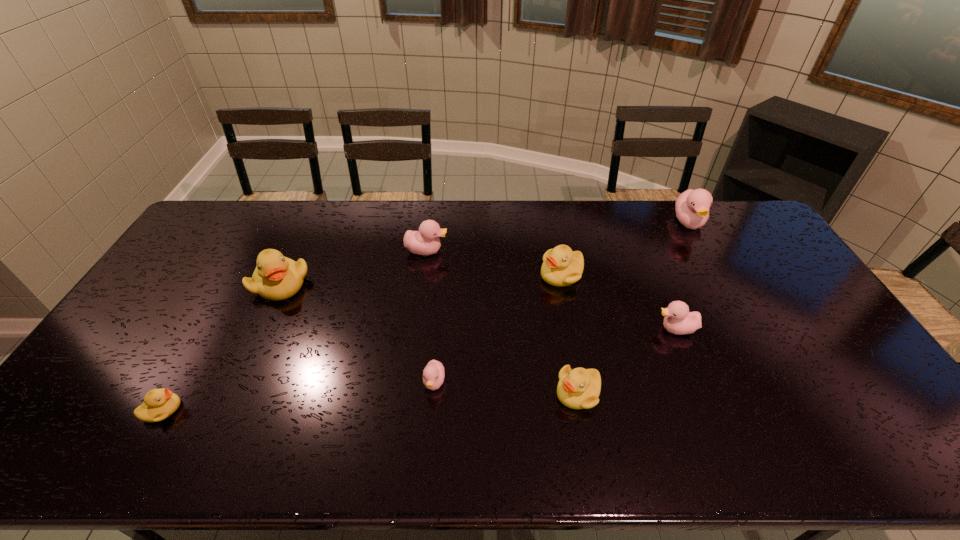
Locate an element on the screen. The image size is (960, 540). the farthest object is located at coordinates (692, 207).

What are the coordinates of `the farthest duckling` in the screenshot? It's located at (692, 207).

Where is `the seventh object from right to left`? Image resolution: width=960 pixels, height=540 pixels. the seventh object from right to left is located at coordinates (276, 277).

This screenshot has width=960, height=540. In order to click on the third yellow duckling from right to left in this screenshot , I will do `click(276, 277)`.

Locate an element on the screen. This screenshot has width=960, height=540. the third nearest pink duckling is located at coordinates click(426, 241).

Identify the location of the third smallest yellow duckling. This screenshot has width=960, height=540. (561, 266).

Where is `the fifth farthest object`? This screenshot has width=960, height=540. the fifth farthest object is located at coordinates (678, 320).

Locate an element on the screen. the second smallest pink duckling is located at coordinates (678, 320).

Find the location of a particular element. This screenshot has height=540, width=960. the second smallest yellow duckling is located at coordinates (579, 388).

Locate an element on the screen. the nearest pink duckling is located at coordinates (x=433, y=375).